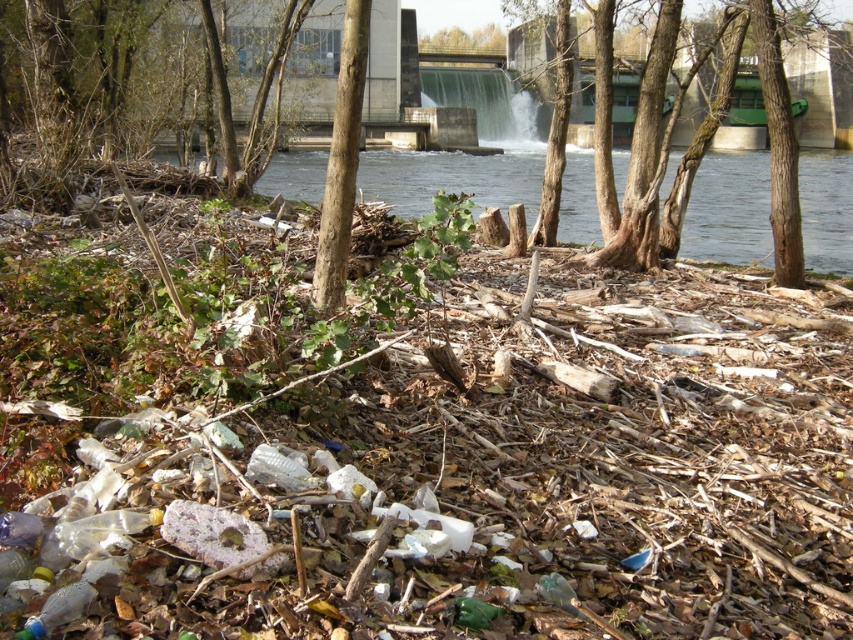
The width and height of the screenshot is (853, 640). In order to click on brown wood tree at upper center in this screenshot , I will do `click(148, 83)`.

Where is `brown wood tree at upper center`? The height and width of the screenshot is (640, 853). brown wood tree at upper center is located at coordinates (148, 83).

Can you confirm if brown wood tree at upper center is positioned below green leafy tree at upper center?

Yes, brown wood tree at upper center is below green leafy tree at upper center.

Is point (320, 61) more distant than point (466, 45)?

No, (320, 61) is in front of (466, 45).

Where is `brown wood tree at upper center`? This screenshot has width=853, height=640. brown wood tree at upper center is located at coordinates click(x=148, y=83).

Can you confirm if smooth bark tree at center is wider than green leafy tree at upper center?

Yes, smooth bark tree at center is wider than green leafy tree at upper center.

Is smooth bark tree at center in front of green leafy tree at upper center?

Yes, it is.

What do you see at coordinates (779, 147) in the screenshot? I see `smooth bark tree at center` at bounding box center [779, 147].

Locate an element on the screen. The height and width of the screenshot is (640, 853). smooth bark tree at center is located at coordinates (779, 147).